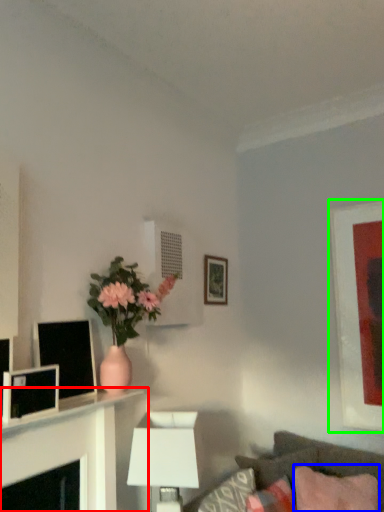
Question: Which is farther away from table (highlighted by a red box)? pillow (highlighted by a blue box) or picture frame (highlighted by a green box)?

Choices:
 (A) pillow
 (B) picture frame

Answer: (B)